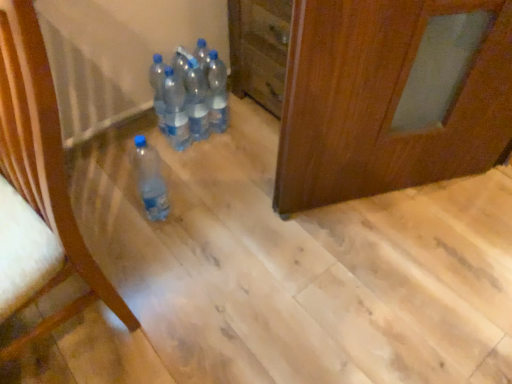
Locate an element on the screen. Image resolution: width=512 pixels, height=384 pixels. empty space that is to the right of translucent plastic bottle at lower left, marked as the 2th bottle in a left-to-right arrangement is located at coordinates (202, 216).